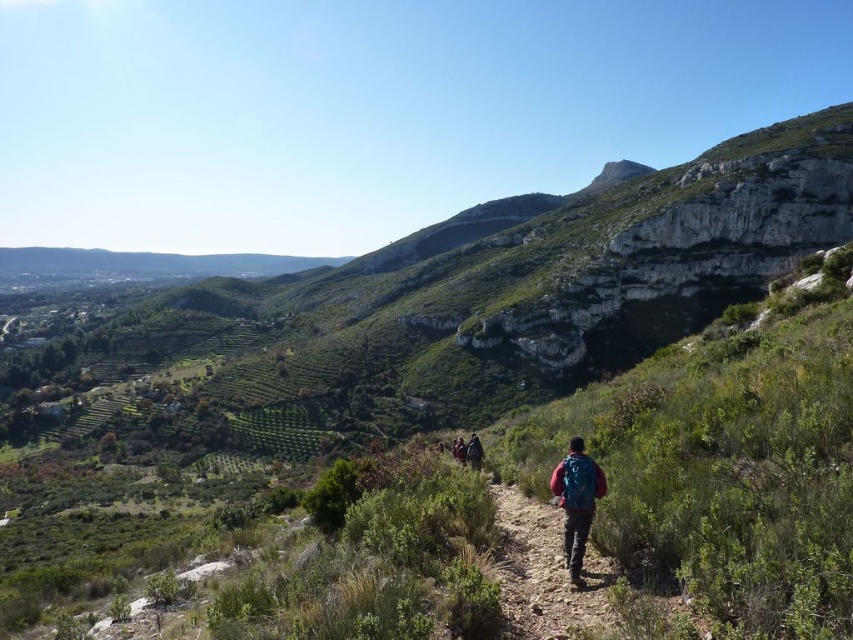
You are a hiker who wants to take a photo of both the matte blue backpack at center and the teal fabric backpack at center. Since you can only focus on one backpack at a time, which one should you focus on to ensure the other is still in the background?

You should focus on the matte blue backpack at center because it is closer to the viewer, allowing the teal fabric backpack at center to remain in the background.

You are a hiker who has lost their teal fabric backpack at center. According to the map coordinates provided, where should you look for it?

The teal fabric backpack at center is located at coordinates point (474,452).

You are a hiker trying to locate your backpack on a crowded hiking trail. You remember that your backpack is blue and has a specific point at coordinate (543, 572). According to the scene description, where should you look for your matte blue backpack at center?

The point at coordinate (543, 572) is on the matte blue backpack at center, so you should look for the backpack in the center of the scene where that point is located.